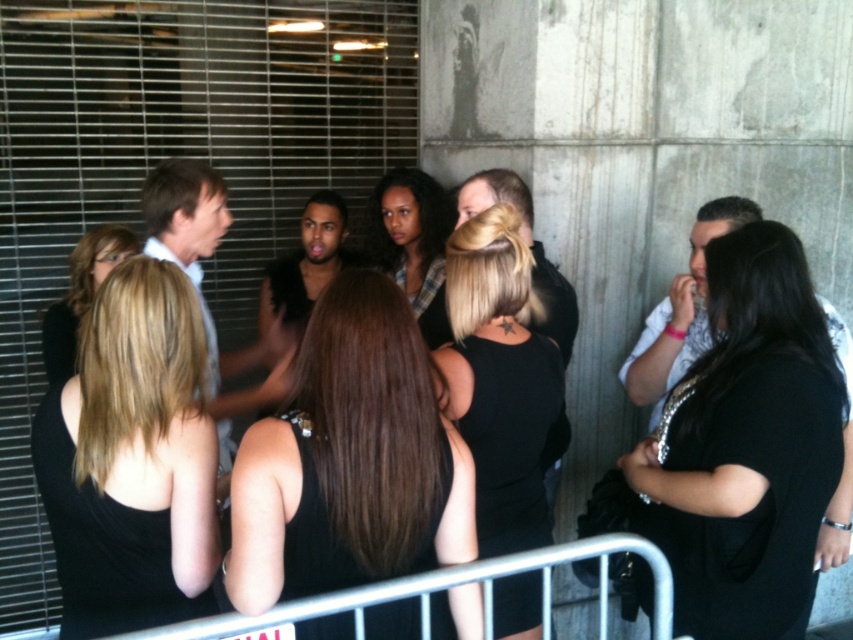
Who is more forward, (418,275) or (138,246)?

Point (138,246)

Does matte black hair at center have a larger size compared to matte black tank top at left?

Yes, matte black hair at center is bigger than matte black tank top at left.

What do you see at coordinates (409, 230) in the screenshot? I see `matte black hair at center` at bounding box center [409, 230].

The image size is (853, 640). In order to click on matte black hair at center in this screenshot , I will do `click(409, 230)`.

Which is below, black sequined dress at right or matte black tank top at left?

black sequined dress at right is below.

Is black sequined dress at right positioned before matte black tank top at left?

Yes, black sequined dress at right is in front of matte black tank top at left.

Is point (813, 355) more distant than point (45, 362)?

No, (813, 355) is in front of (45, 362).

You are a GUI agent. You are given a task and a screenshot of the screen. Output one action in this format:
    pyautogui.click(x=<x>, y=<y>)
    Task: Click on the black sequined dress at right
    
    Given the screenshot: What is the action you would take?
    pyautogui.click(x=746, y=444)

Can you confirm if silver metallic rail at lower center is positioned above matte black tank top at left?

Actually, silver metallic rail at lower center is below matte black tank top at left.

Does silver metallic rail at lower center have a greater width compared to matte black tank top at left?

Indeed, silver metallic rail at lower center has a greater width compared to matte black tank top at left.

Between point (306, 600) and point (64, 296), which one is positioned behind?

Point (64, 296)

The width and height of the screenshot is (853, 640). Identify the location of silver metallic rail at lower center. (445, 588).